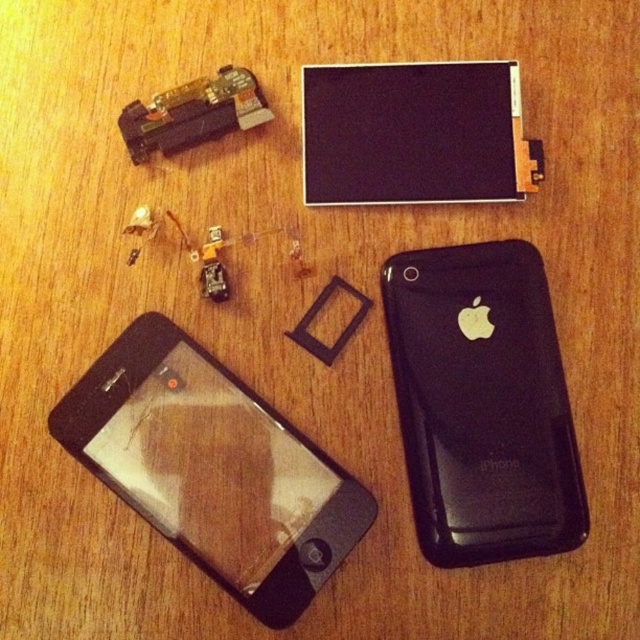
Question: Can you confirm if black glossy iphone at lower left is wider than black matte iphone at right?

Choices:
 (A) yes
 (B) no

Answer: (A)

Question: Is black glossy iphone at lower left positioned before black matte iphone at right?

Choices:
 (A) no
 (B) yes

Answer: (A)

Question: Which of the following is the closest to the observer?

Choices:
 (A) black glossy iphone at lower left
 (B) black matte iphone at right

Answer: (B)

Question: Is black glossy iphone at lower left positioned before black matte iphone at right?

Choices:
 (A) yes
 (B) no

Answer: (B)